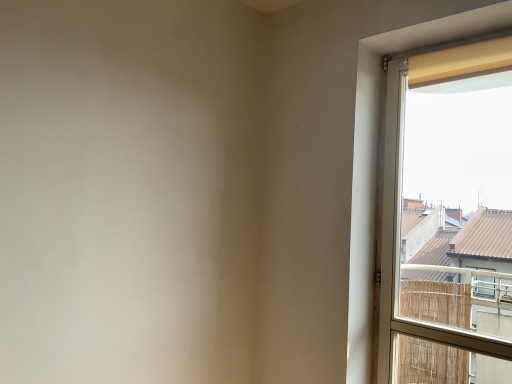
Question: Is matte yellow curtain at right taller or shorter than yellow fabric curtain at upper right?

Choices:
 (A) tall
 (B) short

Answer: (A)

Question: In the image, is matte yellow curtain at right on the left side or the right side of yellow fabric curtain at upper right?

Choices:
 (A) right
 (B) left

Answer: (B)

Question: Looking at the image, does matte yellow curtain at right seem bigger or smaller compared to yellow fabric curtain at upper right?

Choices:
 (A) small
 (B) big

Answer: (B)

Question: Is yellow fabric curtain at upper right situated inside matte yellow curtain at right or outside?

Choices:
 (A) inside
 (B) outside

Answer: (A)

Question: From a real-world perspective, is yellow fabric curtain at upper right physically located above or below matte yellow curtain at right?

Choices:
 (A) below
 (B) above

Answer: (B)

Question: Considering the positions of yellow fabric curtain at upper right and matte yellow curtain at right in the image, is yellow fabric curtain at upper right wider or thinner than matte yellow curtain at right?

Choices:
 (A) wide
 (B) thin

Answer: (B)

Question: In terms of size, does yellow fabric curtain at upper right appear bigger or smaller than matte yellow curtain at right?

Choices:
 (A) small
 (B) big

Answer: (A)